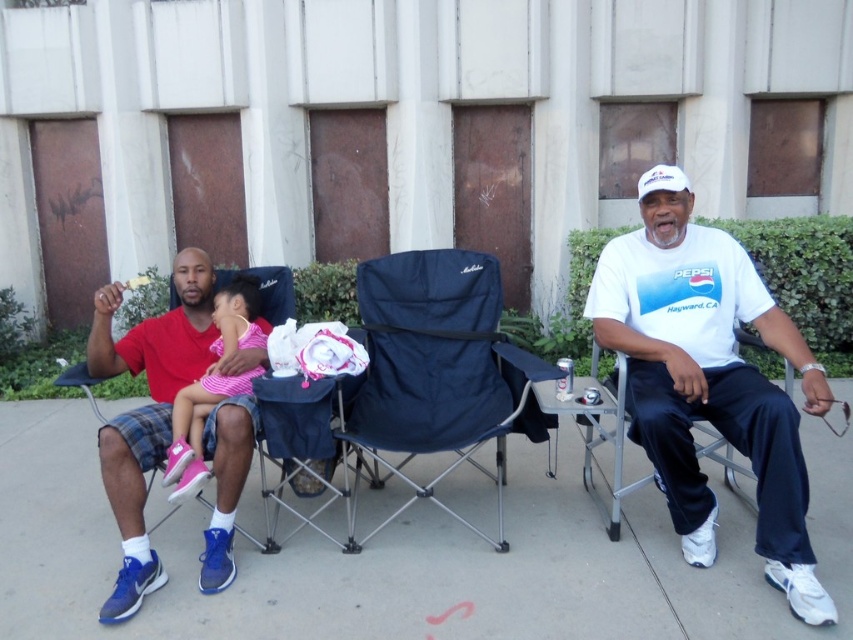
Does white cotton t-shirt at center have a greater width compared to navy blue fabric folding chair at center?

Incorrect, white cotton t-shirt at center's width does not surpass navy blue fabric folding chair at center's.

In the scene shown: Can you confirm if white cotton t-shirt at center is taller than navy blue fabric folding chair at center?

Yes.

Is point (614, 304) less distant than point (407, 276)?

Yes.

I want to click on white cotton t-shirt at center, so click(x=709, y=380).

Which is below, navy blue fabric folding chair at center or pink fabric baby at left?

navy blue fabric folding chair at center is lower down.

Is point (422, 444) positioned behind point (264, 342)?

No, (422, 444) is in front of (264, 342).

Where is `navy blue fabric folding chair at center`? navy blue fabric folding chair at center is located at coordinates (437, 372).

Does white cotton t-shirt at center have a smaller size compared to pink fabric baby at left?

No, white cotton t-shirt at center is not smaller than pink fabric baby at left.

Who is shorter, white cotton t-shirt at center or pink fabric baby at left?

Standing shorter between the two is pink fabric baby at left.

Measure the distance between point (x=704, y=337) and camera.

Point (x=704, y=337) is 9.38 feet from camera.

Identify the location of white cotton t-shirt at center. (709, 380).